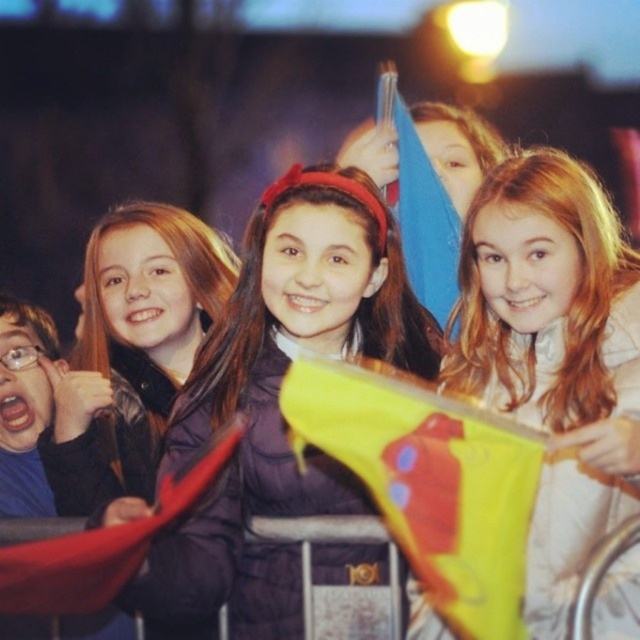
You are a photographer trying to capture a clear photo of the matte black jacket at left. However, the matte red flag at lower left is blocking your view. Can you adjust your position to take the photo without moving the flag or jacket?

The matte red flag at lower left is behind matte black jacket at left, so you can move your position slightly to the right or left to get a clear shot of the matte black jacket at left without the flag blocking the view.

You are a photographer trying to capture the moment. You notice a point at coordinates (x=134, y=346) in the image. What object is located at that point?

The point at coordinates (x=134, y=346) corresponds to the matte black jacket at left.

You are a photographer trying to capture a candid shot of the crowd at the event. You notice the matte purple jacket at center and the light brown hair at center. Which object is located lower in the image?

The matte purple jacket at center is positioned under the light brown hair at center, so it is lower in the image.